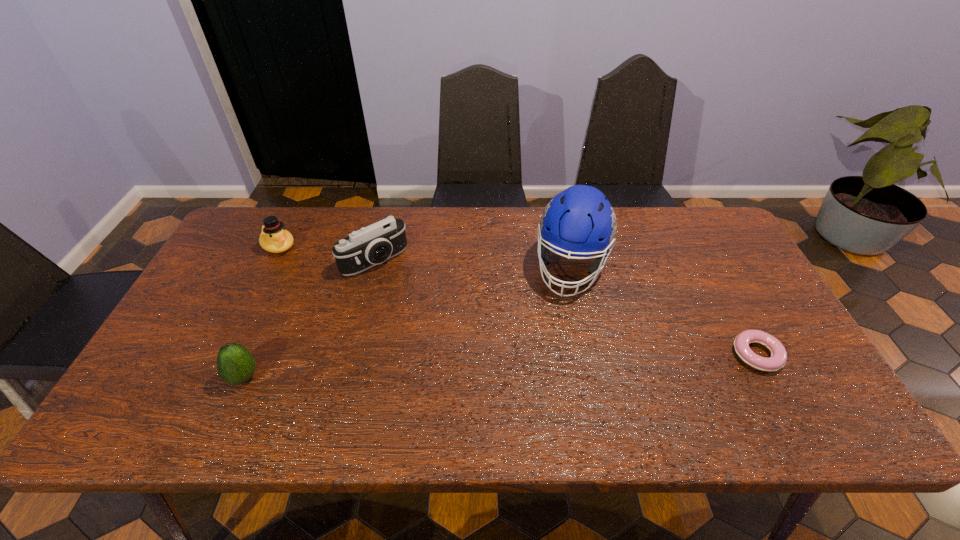
The image size is (960, 540). In order to click on duck that is at the far edge in this screenshot , I will do `click(274, 238)`.

Image resolution: width=960 pixels, height=540 pixels. Find the location of `avocado positioned at the near edge`. avocado positioned at the near edge is located at coordinates (236, 365).

This screenshot has height=540, width=960. In order to click on doughnut that is at the near edge in this screenshot , I will do `click(778, 358)`.

At what (x,y) coordinates should I click in order to perform the action: click on object that is at the left edge. Please return your answer as a coordinate pair (x, y). Image resolution: width=960 pixels, height=540 pixels. Looking at the image, I should click on (274, 238).

Identify the location of object at the right edge. This screenshot has height=540, width=960. (778, 358).

Image resolution: width=960 pixels, height=540 pixels. In order to click on object located in the far left corner section of the desktop in this screenshot , I will do `click(274, 238)`.

At what (x,y) coordinates should I click in order to perform the action: click on object that is at the near right corner. Please return your answer as a coordinate pair (x, y). The width and height of the screenshot is (960, 540). Looking at the image, I should click on (778, 358).

In the image, there is a desktop. Where is `free space at the far edge`? The width and height of the screenshot is (960, 540). free space at the far edge is located at coordinates (443, 222).

I want to click on vacant space at the near edge of the desktop, so click(357, 387).

Locate an element on the screen. Image resolution: width=960 pixels, height=540 pixels. vacant region at the left edge of the desktop is located at coordinates (225, 258).